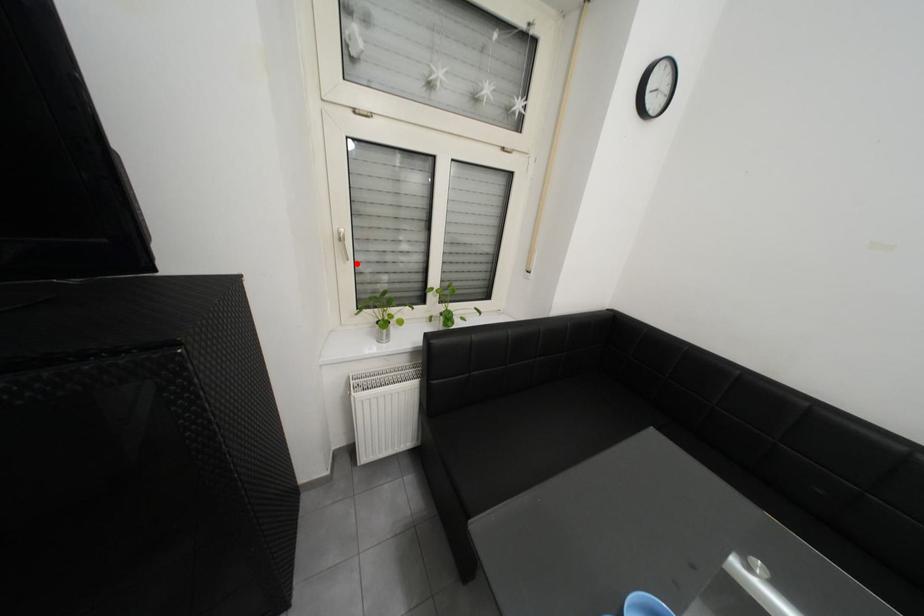
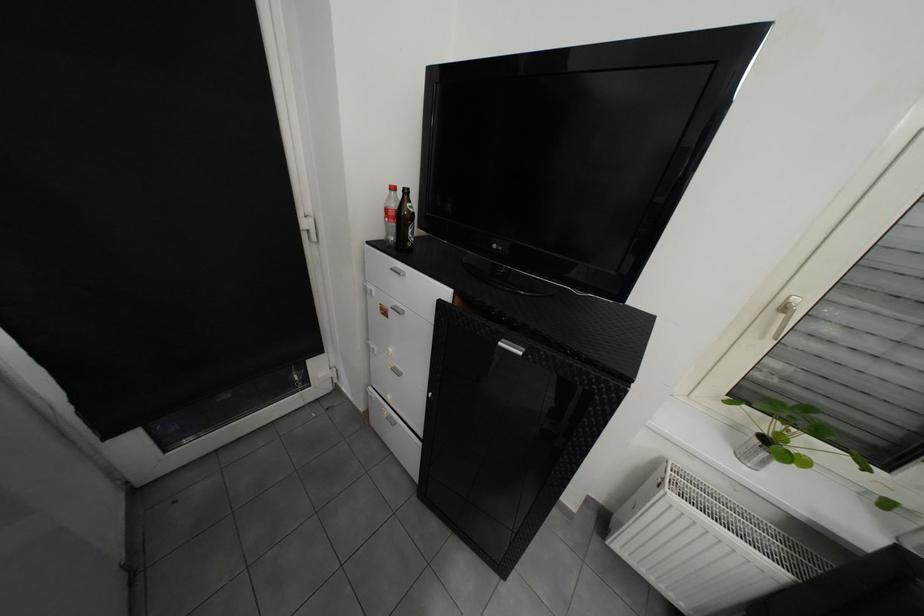
Where in the second image is the point corresponding to the highlighted location from the first image?

(773, 339)